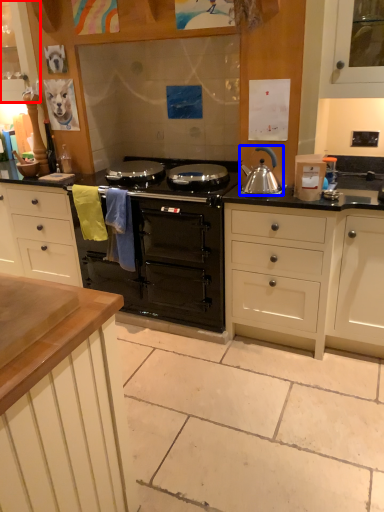
Question: Which object is closer to the camera taking this photo, cabinetry (highlighted by a red box) or kitchen appliance (highlighted by a blue box)?

Choices:
 (A) cabinetry
 (B) kitchen appliance

Answer: (B)